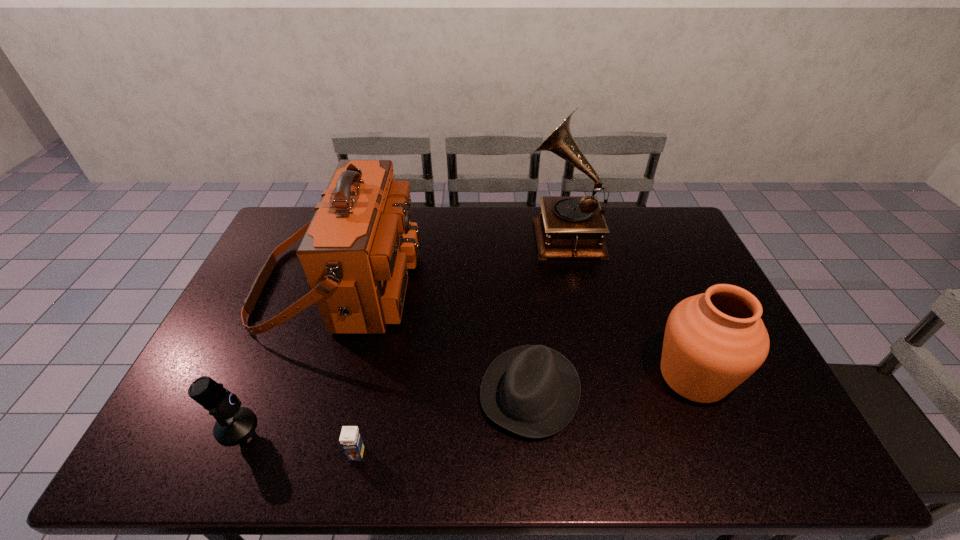
Find the location of a particular element. vacant area between the record player and the fourth shortest object is located at coordinates (x=628, y=305).

Where is `blank region between the record player and the satchel`? blank region between the record player and the satchel is located at coordinates (450, 260).

At what (x,y) coordinates should I click in order to perform the action: click on unoccupied position between the fedora and the fourth shortest object. Please return your answer as a coordinate pair (x, y). This screenshot has width=960, height=540. Looking at the image, I should click on (612, 384).

Identify the location of free space that is in between the microphone and the satchel. Image resolution: width=960 pixels, height=540 pixels. (287, 356).

The width and height of the screenshot is (960, 540). Find the location of `vacant space that is in between the fedora and the rightmost object`. vacant space that is in between the fedora and the rightmost object is located at coordinates (612, 384).

In order to click on blank region between the fedora and the satchel in this screenshot , I will do `click(434, 339)`.

This screenshot has width=960, height=540. In order to click on free point between the fedora and the nearest object in this screenshot , I will do (444, 423).

This screenshot has height=540, width=960. I want to click on empty space between the record player and the third shortest object, so click(398, 329).

Identify the location of object that stands as the closest to the satchel. The image size is (960, 540). (233, 423).

Find the location of a particular element. The height and width of the screenshot is (540, 960). object that stands as the second closest to the satchel is located at coordinates (533, 391).